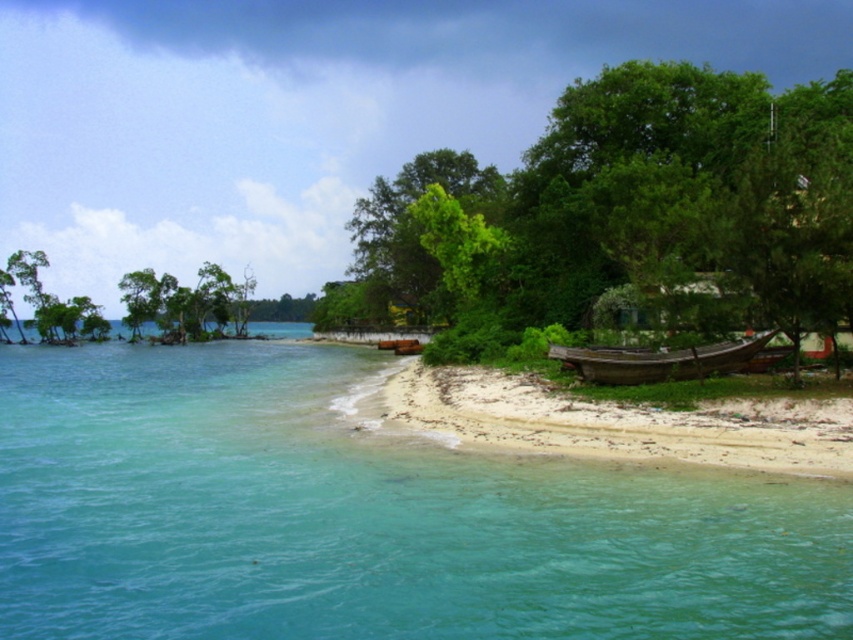
Question: Among these objects, which one is farthest from the camera?

Choices:
 (A) green leafy trees at center
 (B) wooden boat at right

Answer: (A)

Question: Among these points, which one is farthest from the camera?

Choices:
 (A) click(206, 330)
 (B) click(722, 342)

Answer: (A)

Question: Does clear blue water at lower left appear on the right side of green leafy tree at upper center?

Choices:
 (A) no
 (B) yes

Answer: (B)

Question: Which of these objects is positioned farthest from the green leafy tree at center?

Choices:
 (A) wooden boat at right
 (B) white sandy beach at lower right
 (C) green leafy tree at upper center
 (D) green leafy trees at center

Answer: (A)

Question: Does green leafy tree at center have a smaller size compared to green leafy trees at center?

Choices:
 (A) yes
 (B) no

Answer: (A)

Question: Does green leafy tree at center have a lesser width compared to white sandy beach at lower right?

Choices:
 (A) no
 (B) yes

Answer: (A)